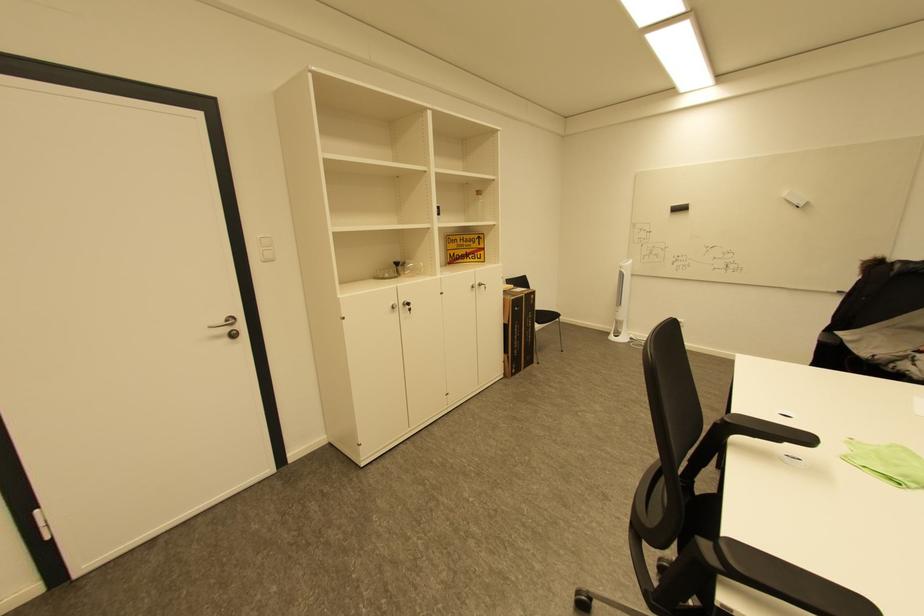
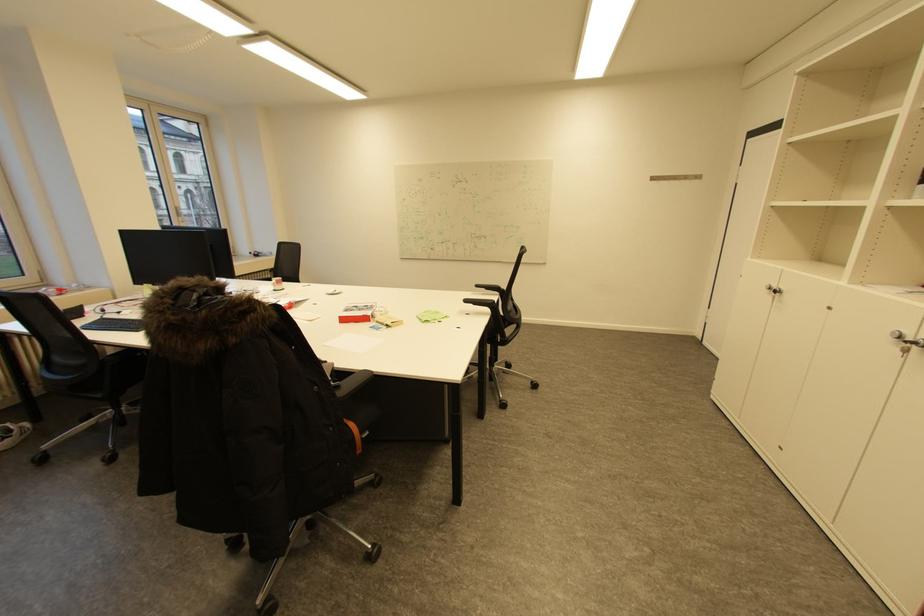
Find the pixel in the second image that matches (x=794, y=444) in the first image.

(480, 304)